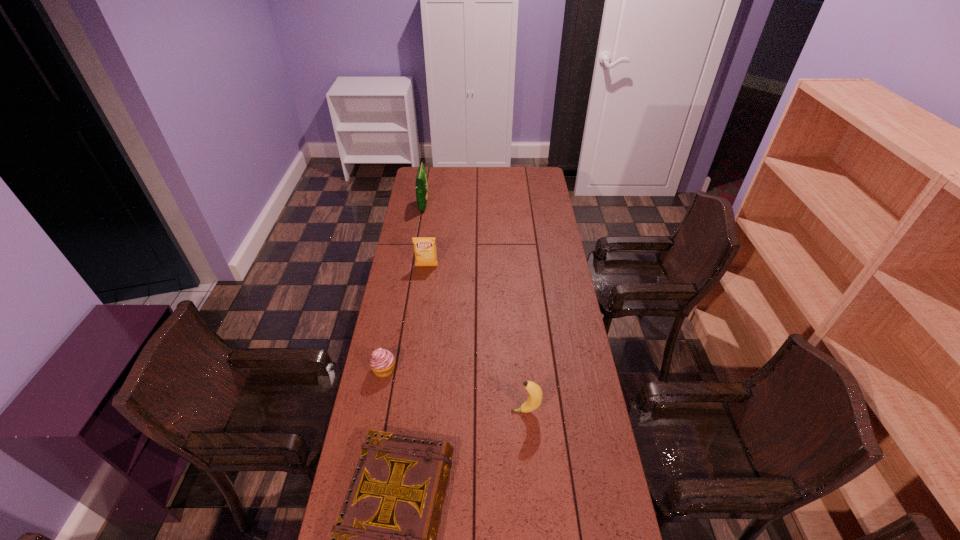
The image size is (960, 540). Identify the location of unoccupied position between the nearer crisp (potato chip) and the farthest object. pyautogui.click(x=425, y=236).

The width and height of the screenshot is (960, 540). I want to click on free space between the fourth tallest object and the tallest object, so click(404, 288).

The height and width of the screenshot is (540, 960). I want to click on empty space that is in between the third nearest object and the tallest object, so click(x=404, y=288).

Where is `empty space that is in between the cupcake and the rightmost object`? The height and width of the screenshot is (540, 960). empty space that is in between the cupcake and the rightmost object is located at coordinates (455, 390).

Identify the location of vacant area between the rightmost object and the third nearest object. (455, 390).

Locate which object is the closest to the cupcake. Please provide its 2D coordinates. Your answer should be formatted as a tuple, i.e. [(x, y)], where the tuple contains the x and y coordinates of a point satisfying the conditions above.

[(384, 539)]

Identify the location of object that can be found as the fourth closest to the nearer crisp (potato chip). (384, 539).